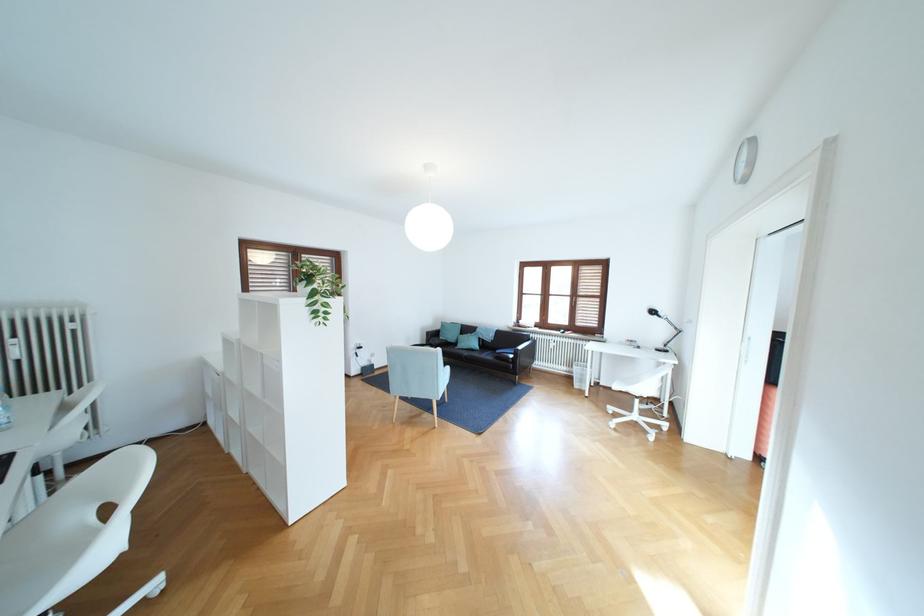
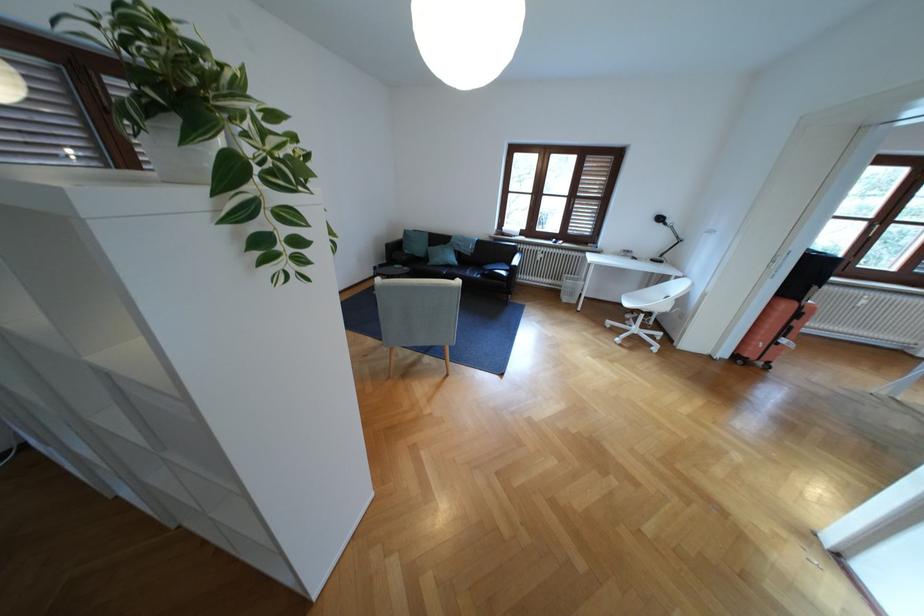
Find the pixel in the second image that matches pixel 313 290 in the first image.

(187, 155)